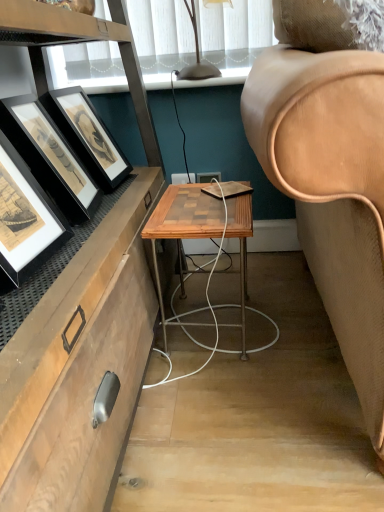
Question: Considering the relative sizes of woodenmaterial/texturetable at center and matte black table lamp at upper center in the image provided, is woodenmaterial/texturetable at center wider than matte black table lamp at upper center?

Choices:
 (A) yes
 (B) no

Answer: (A)

Question: Can you confirm if woodenmaterial/texturetable at center is bigger than matte black table lamp at upper center?

Choices:
 (A) no
 (B) yes

Answer: (B)

Question: Would you say woodenmaterial/texturetable at center is a long distance from matte black table lamp at upper center?

Choices:
 (A) no
 (B) yes

Answer: (A)

Question: Considering the relative sizes of woodenmaterial/texturetable at center and matte black table lamp at upper center in the image provided, is woodenmaterial/texturetable at center shorter than matte black table lamp at upper center?

Choices:
 (A) no
 (B) yes

Answer: (A)

Question: Does woodenmaterial/texturetable at center appear on the left side of matte black table lamp at upper center?

Choices:
 (A) no
 (B) yes

Answer: (A)

Question: Is black matte picture frame at left, positioned as the 1th picture frame in back-to-front order, in front of or behind woodenmaterial/texturetable at center in the image?

Choices:
 (A) front
 (B) behind

Answer: (A)

Question: Does point (87, 199) appear closer or farther from the camera than point (178, 231)?

Choices:
 (A) closer
 (B) farther

Answer: (B)

Question: From the image's perspective, is black matte picture frame at left, positioned as the 1th picture frame in back-to-front order, positioned above or below woodenmaterial/texturetable at center?

Choices:
 (A) below
 (B) above

Answer: (B)

Question: In terms of width, does black matte picture frame at left, the 2th picture frame from the front, look wider or thinner when compared to woodenmaterial/texturetable at center?

Choices:
 (A) thin
 (B) wide

Answer: (A)

Question: Would you say black matte picture frame at left, acting as the first picture frame starting from the front, is inside or outside matte black table lamp at upper center?

Choices:
 (A) outside
 (B) inside

Answer: (A)

Question: Looking at the image, does black matte picture frame at left, the second picture frame from the back, seem bigger or smaller compared to matte black table lamp at upper center?

Choices:
 (A) big
 (B) small

Answer: (A)

Question: From a real-world perspective, is black matte picture frame at left, the second picture frame from the back, above or below matte black table lamp at upper center?

Choices:
 (A) below
 (B) above

Answer: (A)

Question: Is point (39, 264) positioned closer to the camera than point (188, 76)?

Choices:
 (A) closer
 (B) farther

Answer: (A)

Question: Would you say black matte picture frame at left, the second picture frame from the back, is inside or outside woodenmaterial/texturetable at center?

Choices:
 (A) outside
 (B) inside

Answer: (A)

Question: Considering their positions, is black matte picture frame at left, the second picture frame from the back, located in front of or behind woodenmaterial/texturetable at center?

Choices:
 (A) behind
 (B) front

Answer: (B)